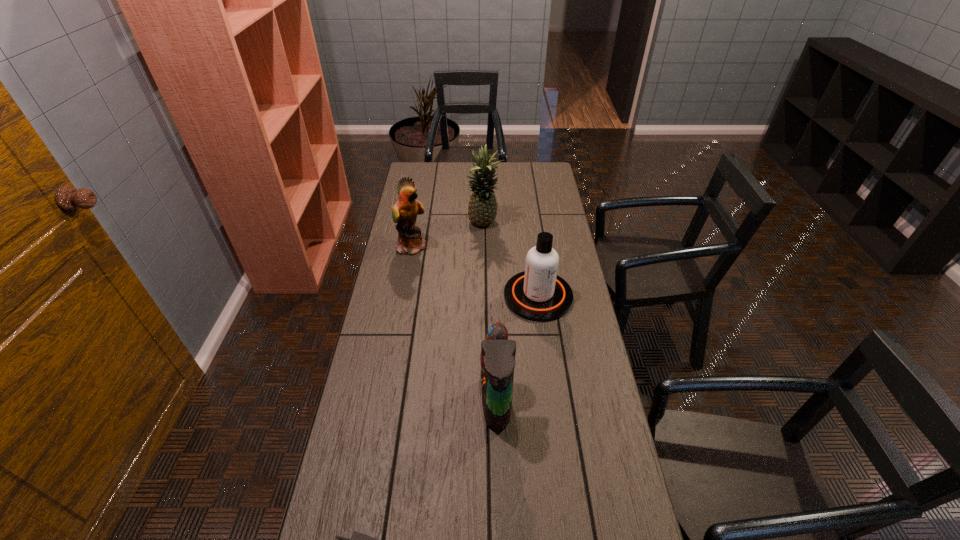
You are a GUI agent. You are given a task and a screenshot of the screen. Output one action in this format:
    pyautogui.click(x=<x>, y=<y>)
    Task: Click on the free space between the shorter parrot and the taller parrot
    
    Given the screenshot: What is the action you would take?
    pyautogui.click(x=454, y=323)

You are a GUI agent. You are given a task and a screenshot of the screen. Output one action in this format:
    pyautogui.click(x=<x>, y=<y>)
    Task: Click on the empty space that is in between the pineapple and the cleansing agent
    
    Given the screenshot: What is the action you would take?
    pos(511,260)

You are a GUI agent. You are given a task and a screenshot of the screen. Output one action in this format:
    pyautogui.click(x=<x>, y=<y>)
    Task: Click on the empty space between the pineapple and the cleansing agent
    
    Given the screenshot: What is the action you would take?
    pyautogui.click(x=511, y=260)

Locate an element on the screen. free spot between the pineapple and the third farthest object is located at coordinates (511, 260).

This screenshot has height=540, width=960. What are the coordinates of `vacant region between the left parrot and the cleansing agent` in the screenshot? It's located at (475, 271).

The image size is (960, 540). I want to click on vacant region between the taller parrot and the pineapple, so pos(448,235).

The height and width of the screenshot is (540, 960). I want to click on object that stands as the fourth closest to the cleansing agent, so click(x=357, y=539).

Where is `object that is the fourth closest to the right parrot`? Image resolution: width=960 pixels, height=540 pixels. object that is the fourth closest to the right parrot is located at coordinates (482, 209).

Where is `vacant position in the image that satisfies the following two spatial constraints: 1. on the front-facing side of the third farthest object; 2. on the right side of the taller parrot`? vacant position in the image that satisfies the following two spatial constraints: 1. on the front-facing side of the third farthest object; 2. on the right side of the taller parrot is located at coordinates click(x=403, y=296).

Image resolution: width=960 pixels, height=540 pixels. Identify the location of vacant area that satisfies the following two spatial constraints: 1. on the front-facing side of the third nearest object; 2. on the right side of the left parrot. (403, 296).